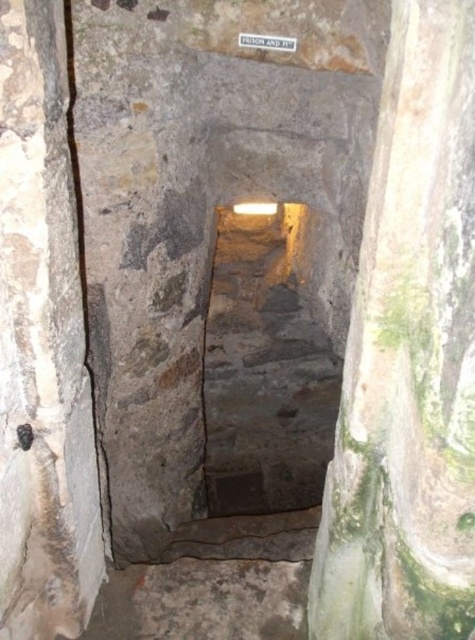
Is point (442, 96) positioned after point (18, 156)?

No, (442, 96) is in front of (18, 156).

Can you confirm if green mossy stone pillar at center is thinner than gray stone pillar at left?

Yes, green mossy stone pillar at center is thinner than gray stone pillar at left.

Between point (450, 282) and point (53, 388), which one is positioned in front?

Point (450, 282)

The width and height of the screenshot is (475, 640). I want to click on green mossy stone pillar at center, so click(x=408, y=356).